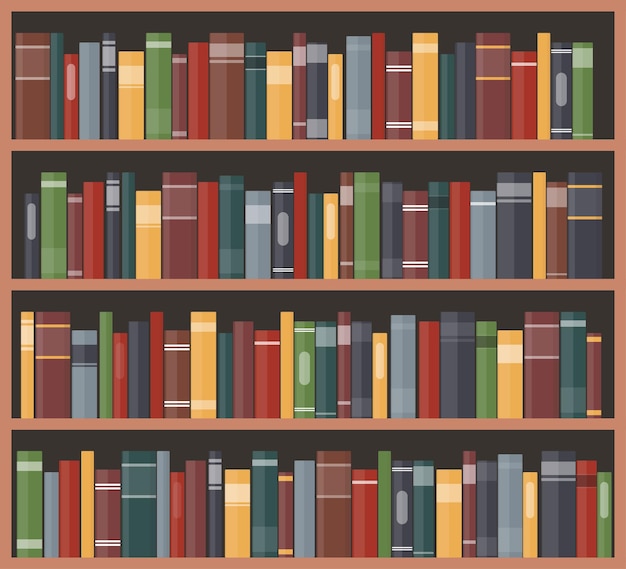
Find the location of a particular element. shelves is located at coordinates (280, 560), (292, 419), (316, 277), (317, 139).